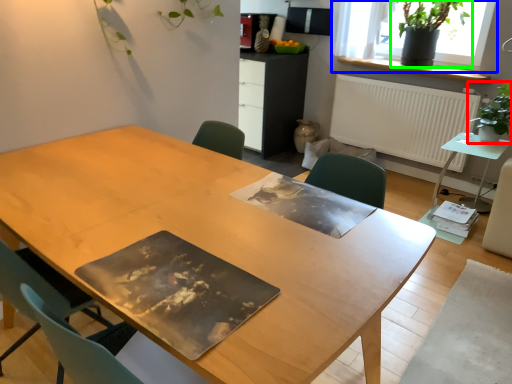
Question: Considering the real-world distances, which object is farthest from houseplant (highlighted by a red box)? window (highlighted by a blue box) or houseplant (highlighted by a green box)?

Choices:
 (A) window
 (B) houseplant

Answer: (B)